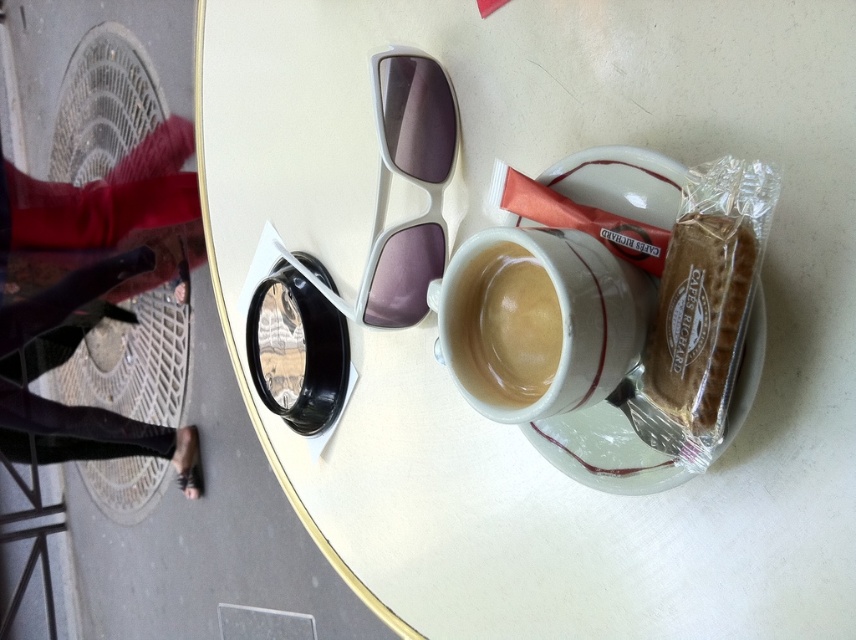
Question: In this image, where is black leather pants at lower left located relative to matte ceramic mug at center?

Choices:
 (A) above
 (B) below

Answer: (A)

Question: Which of the following is the closest to the observer?

Choices:
 (A) pos(82,410)
 (B) pos(568,282)
 (C) pos(504,394)
 (D) pos(646,440)

Answer: (B)

Question: Which point is closer to the camera?

Choices:
 (A) matte ceramic mug at center
 (B) black leather pants at lower left
 (C) white porcelain saucer at upper center
 (D) white ceramic mug at center

Answer: (D)

Question: Which point is farther from the camera taking this photo?

Choices:
 (A) (601, 275)
 (B) (480, 340)
 (C) (681, 278)

Answer: (B)

Question: Can you confirm if black leather pants at lower left is thinner than matte ceramic mug at center?

Choices:
 (A) yes
 (B) no

Answer: (B)

Question: In this image, where is white porcelain saucer at upper center located relative to matte ceramic mug at center?

Choices:
 (A) below
 (B) above

Answer: (B)